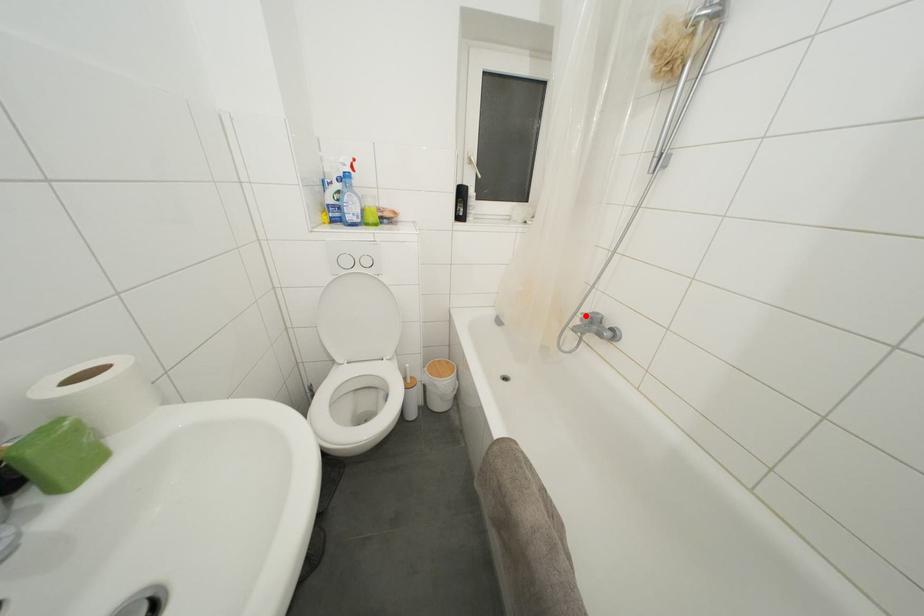
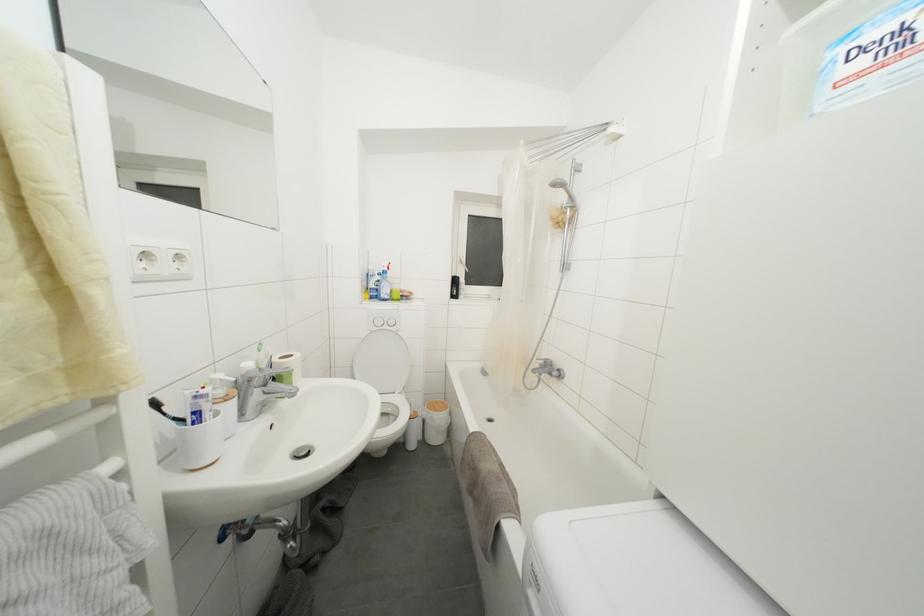
Question: I am providing you with two images of the same scene from different viewpoints. Given a red point in image1, look at the same physical point in image2. Is it:

Choices:
 (A) Closer to the viewpoint
 (B) Farther from the viewpoint

Answer: (B)